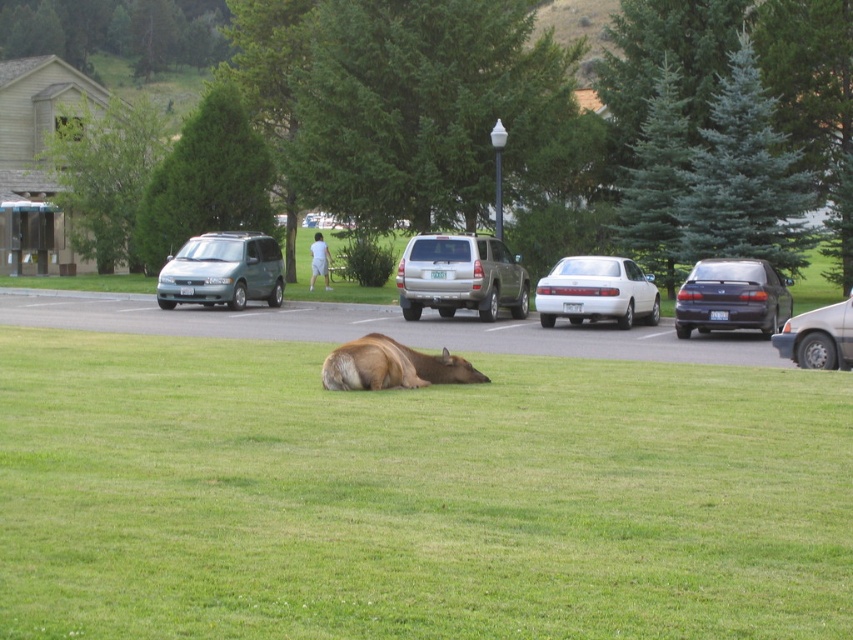
Question: Does teal matte minivan at center have a lesser width compared to white glossy sedan at center?

Choices:
 (A) yes
 (B) no

Answer: (A)

Question: Among these points, which one is nearest to the camera?

Choices:
 (A) (186, 291)
 (B) (450, 362)

Answer: (B)

Question: Considering the real-world distances, which object is farthest from the gold metallic suv at center?

Choices:
 (A) green grass at center
 (B) matte black sedan at right
 (C) silver metallic sedan at right

Answer: (A)

Question: Does green grass at center have a larger size compared to silver metallic sedan at right?

Choices:
 (A) no
 (B) yes

Answer: (A)

Question: Which object appears farthest from the camera in this image?

Choices:
 (A) silver metallic sedan at right
 (B) gold metallic suv at center

Answer: (B)

Question: Can you confirm if green grass at center is positioned to the left of matte black sedan at right?

Choices:
 (A) no
 (B) yes

Answer: (B)